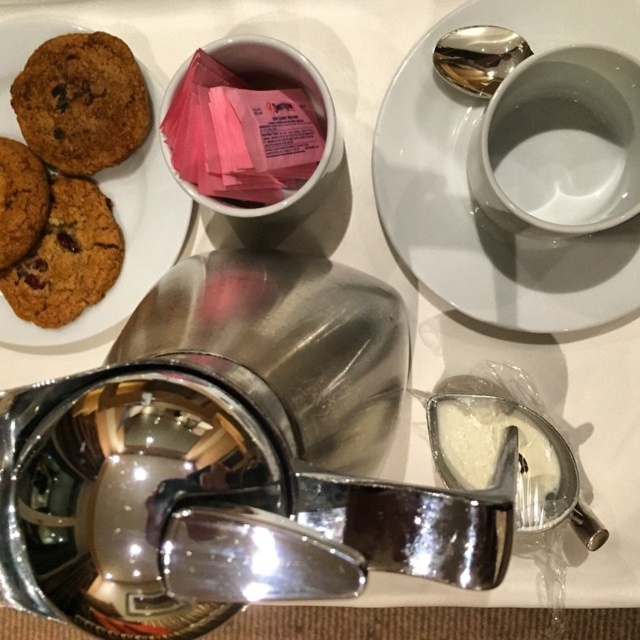
Question: Which of the following is the farthest from the observer?

Choices:
 (A) (528, 52)
 (B) (32, 48)

Answer: (B)

Question: Is white glossy cup at upper right positioned in front of brown matte cookie plate at upper left?

Choices:
 (A) no
 (B) yes

Answer: (B)

Question: From the image, what is the correct spatial relationship of white glossy cup at upper right in relation to brown matte cookie plate at upper left?

Choices:
 (A) left
 (B) right

Answer: (B)

Question: Is brown matte cookie plate at upper left below brown matte cookie at left?

Choices:
 (A) yes
 (B) no

Answer: (B)

Question: Which is nearer to the shiny metallic spoon at upper center?

Choices:
 (A) white glossy cup at upper right
 (B) brown matte cookie at left
 (C) brown matte cookie plate at upper left

Answer: (A)

Question: Which object appears closest to the camera in this image?

Choices:
 (A) chocolate chip cookie at left
 (B) brown matte cookie at left
 (C) shiny metallic spoon at upper center
 (D) brown matte cookie plate at upper left

Answer: (C)